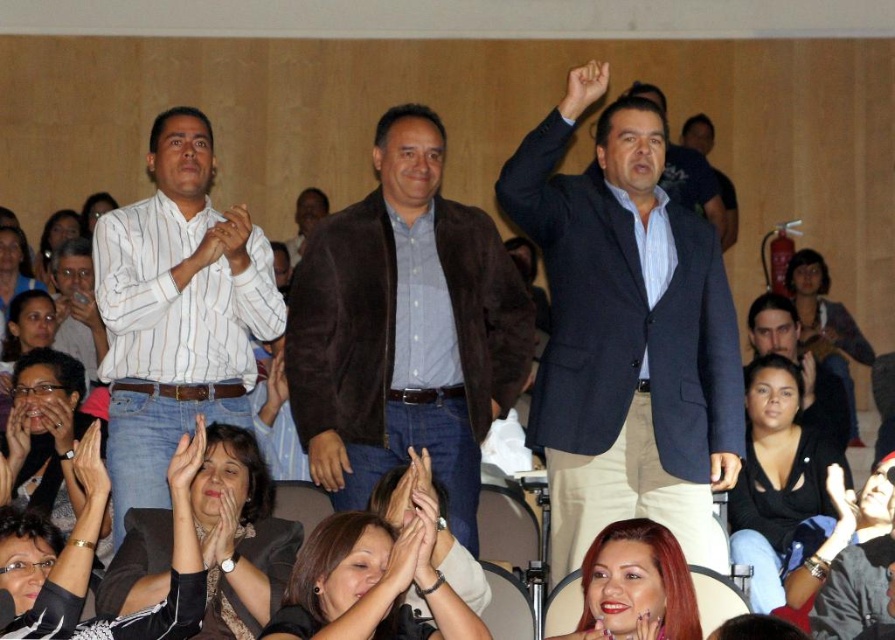
Can you confirm if dark blue suit at center is positioned above dark brown leather jacket at center?

Correct, dark blue suit at center is located above dark brown leather jacket at center.

Between dark blue suit at center and dark brown leather jacket at center, which one is positioned higher?

Positioned higher is dark blue suit at center.

Between point (556, 140) and point (804, 362), which one is positioned in front?

Point (556, 140)

Locate an element on the screen. The image size is (895, 640). dark blue suit at center is located at coordinates (626, 333).

Can you confirm if white striped shirt at left is positioned to the right of white striped shirt at center?

Yes, white striped shirt at left is to the right of white striped shirt at center.

Which is more to the left, white striped shirt at left or white striped shirt at center?

white striped shirt at center is more to the left.

This screenshot has height=640, width=895. In order to click on white striped shirt at left in this screenshot , I will do `click(177, 310)`.

Locate an element on the screen. The image size is (895, 640). white striped shirt at left is located at coordinates (177, 310).

Does shiny red hair at lower center appear over dark blue shirt at upper center?

Actually, shiny red hair at lower center is below dark blue shirt at upper center.

Is point (620, 589) in front of point (714, 168)?

Yes.

Is point (589, 589) behind point (730, 182)?

No.

Locate an element on the screen. This screenshot has height=640, width=895. shiny red hair at lower center is located at coordinates (635, 586).